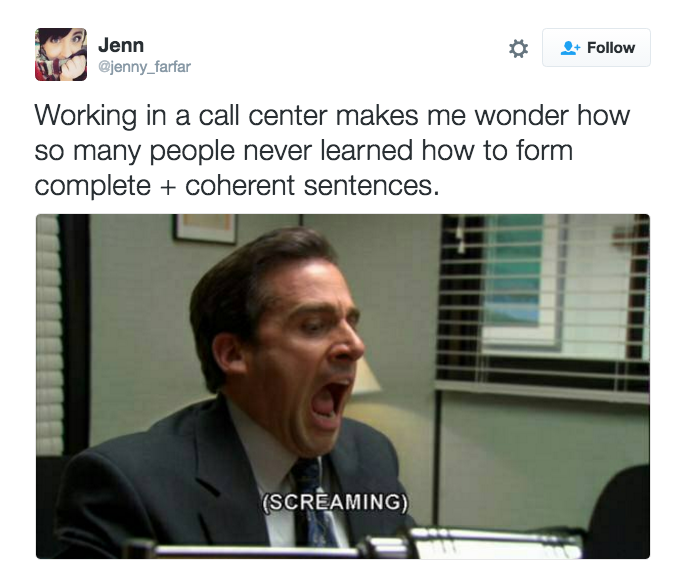
Identify the location of window. The height and width of the screenshot is (574, 693). (527, 327), (576, 363), (484, 356).